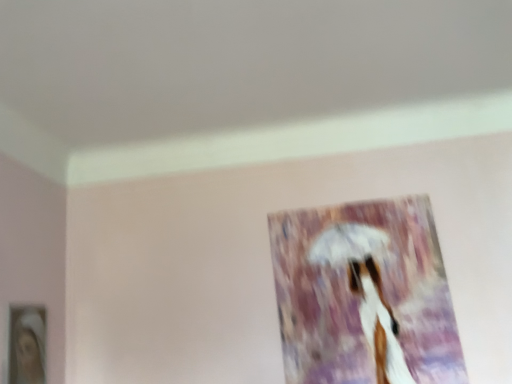
Question: Looking at their shapes, would you say matte white picture frame at lower left, the 2th picture frame when ordered from back to front, is wider or thinner than matte glass picture frame at center, acting as the 1th picture frame starting from the back?

Choices:
 (A) wide
 (B) thin

Answer: (A)

Question: Relative to matte glass picture frame at center, acting as the 1th picture frame starting from the back, is matte white picture frame at lower left, which appears as the 1th picture frame when viewed from the left, in front or behind?

Choices:
 (A) front
 (B) behind

Answer: (A)

Question: Is matte white picture frame at lower left, which is counted as the 2th picture frame, starting from the right, to the left or to the right of matte glass picture frame at center, acting as the 1th picture frame starting from the back, in the image?

Choices:
 (A) right
 (B) left

Answer: (B)

Question: Does point (425, 271) appear closer or farther from the camera than point (28, 360)?

Choices:
 (A) closer
 (B) farther

Answer: (B)

Question: Is matte glass picture frame at center, positioned as the first picture frame in right-to-left order, taller or shorter than matte white picture frame at lower left, which is the 1th picture frame from front to back?

Choices:
 (A) tall
 (B) short

Answer: (A)

Question: From the image's perspective, is matte glass picture frame at center, positioned as the first picture frame in right-to-left order, above or below matte white picture frame at lower left, which is counted as the 2th picture frame, starting from the right?

Choices:
 (A) below
 (B) above

Answer: (B)

Question: Looking at their shapes, would you say matte glass picture frame at center, which appears as the 2th picture frame when viewed from the front, is wider or thinner than matte white picture frame at lower left, which is the 1th picture frame from front to back?

Choices:
 (A) thin
 (B) wide

Answer: (A)